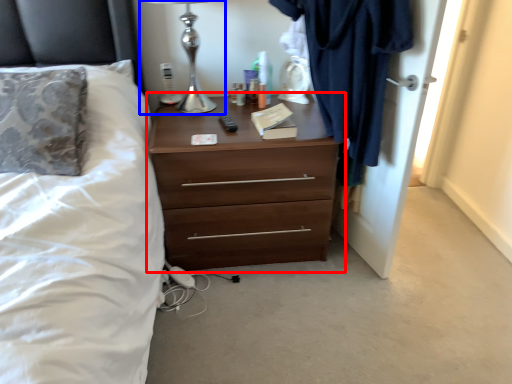
Question: Which point is closer to the camera, chest of drawers (highlighted by a red box) or table lamp (highlighted by a blue box)?

Choices:
 (A) chest of drawers
 (B) table lamp

Answer: (B)